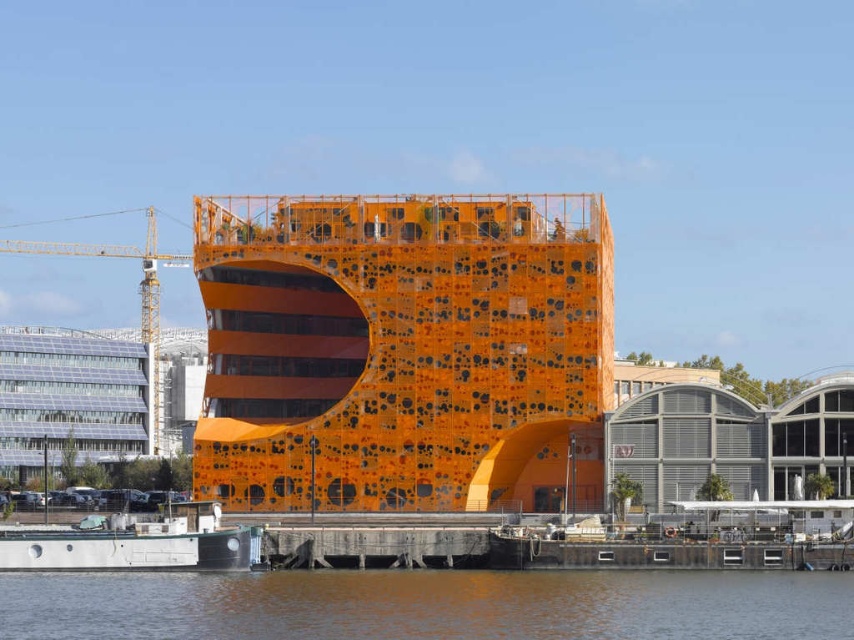
You are standing on the waterfront and want to take a photo of the orange matte building at center. If your camera has a maximum zoom range of 100 meters, will you be able to capture the entire building in the photo without moving closer?

The orange matte building at center is 114.13 meters away from the viewer. Since the camera can only zoom up to 100 meters, you will not be able to capture the entire building in the photo without moving closer.

You are standing on the concrete dock at lower center and want to board the metallic gray boat at lower left. Is the boat directly in front of you, or do you need to walk around the dock to reach it?

The metallic gray boat at lower left is in front of the concrete dock at lower center, so you can board it directly without needing to walk around the dock.

You are an architect evaluating the spatial compatibility of the orange matte building at center and the yellow metallic crane at upper left. Based on their heights, can the crane safely operate near the building without risk of collision?

The orange matte building at center is shorter than the yellow metallic crane at upper left, so the crane can safely operate near the building without risk of collision as it is taller and less likely to hit the shorter structure.